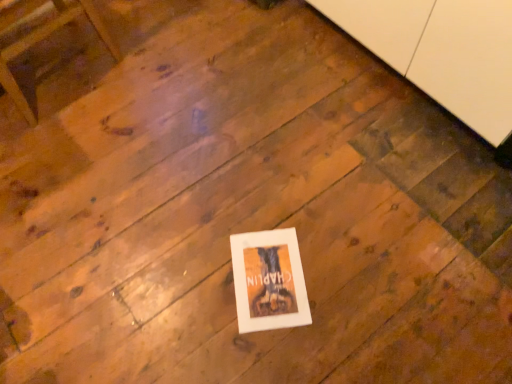
Where is `free region on the left part of white paper at center`? free region on the left part of white paper at center is located at coordinates (192, 282).